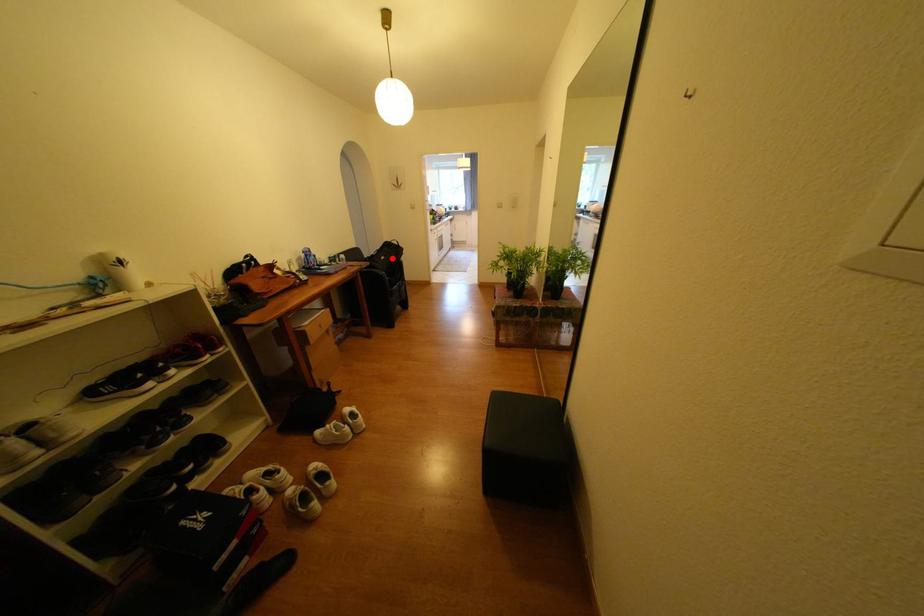
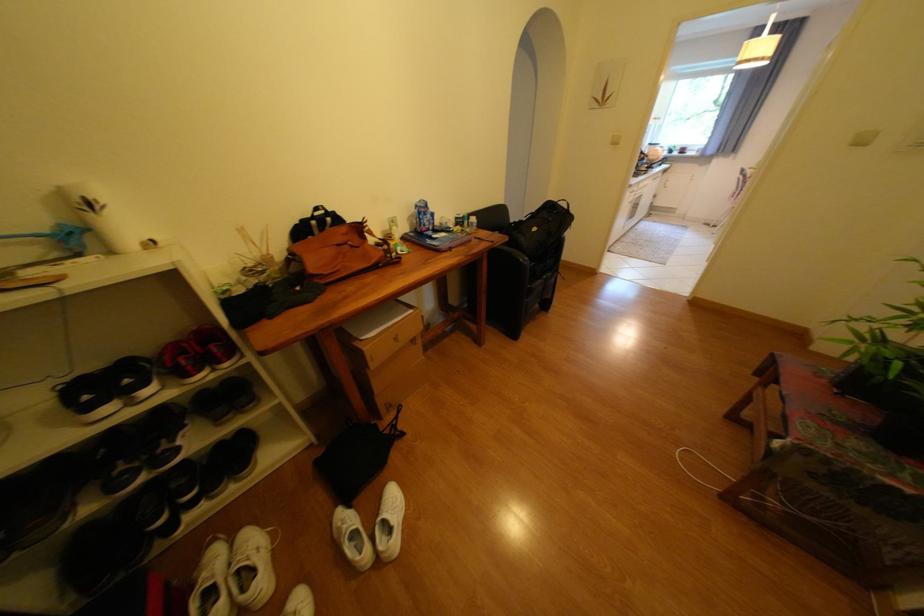
Question: A red point is marked in image1. In image2, is the corresponding 3D point closer to the camera or farther? Reply with the corresponding letter.

Choices:
 (A) The corresponding 3D point is closer.
 (B) The corresponding 3D point is farther.

Answer: (B)